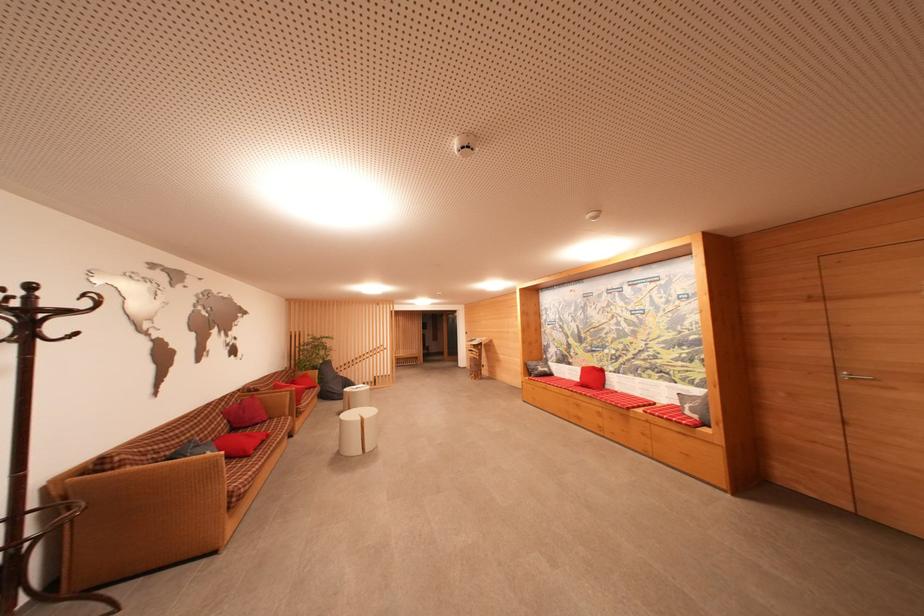
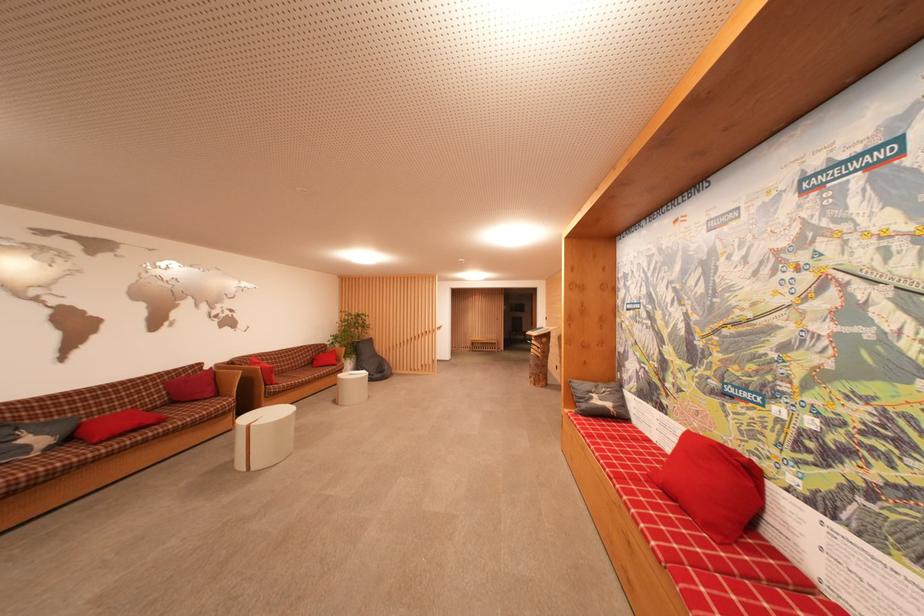
Find the pixel in the second image that matches (544,371) in the first image.

(601, 405)